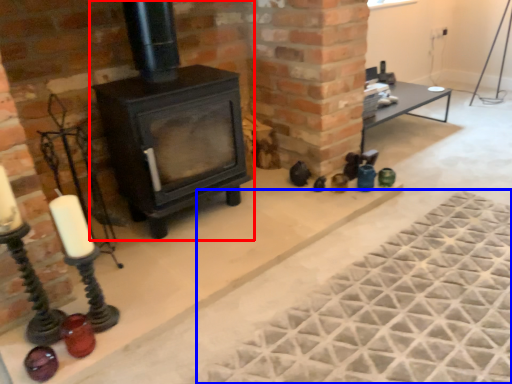
Question: Which of the following is the closest to the observer, wood burning stove (highlighted by a red box) or mat (highlighted by a blue box)?

Choices:
 (A) wood burning stove
 (B) mat

Answer: (B)